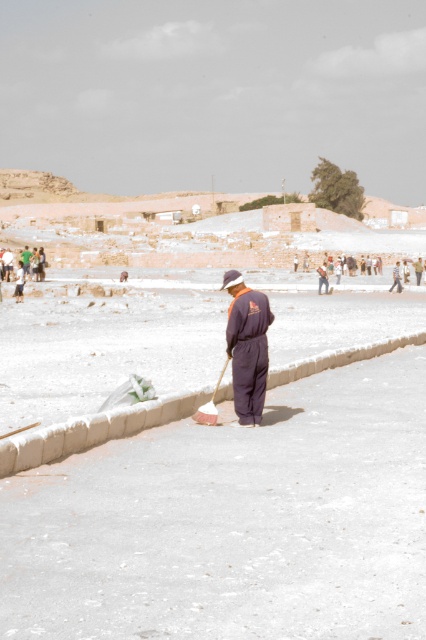
Is white concrete pavement at center above dark blue jumpsuit at center?

No, white concrete pavement at center is not above dark blue jumpsuit at center.

Is white concrete pavement at center to the right of dark blue jumpsuit at center from the viewer's perspective?

In fact, white concrete pavement at center is to the left of dark blue jumpsuit at center.

The height and width of the screenshot is (640, 426). Describe the element at coordinates (233, 522) in the screenshot. I see `white concrete pavement at center` at that location.

Identify the location of white concrete pavement at center. (233, 522).

Can you confirm if white concrete pavement at center is positioned to the left of white plastic shovel at center?

In fact, white concrete pavement at center is to the right of white plastic shovel at center.

Which of these two, white concrete pavement at center or white plastic shovel at center, stands taller?

Standing taller between the two is white plastic shovel at center.

What do you see at coordinates (233, 522) in the screenshot?
I see `white concrete pavement at center` at bounding box center [233, 522].

I want to click on white concrete pavement at center, so click(233, 522).

Is dark blue jumpsuit at center further to the viewer compared to white plastic shovel at center?

Yes, dark blue jumpsuit at center is further from the viewer.

Looking at this image, between dark blue jumpsuit at center and white plastic shovel at center, which one has less height?

A: dark blue jumpsuit at center

What do you see at coordinates (247, 346) in the screenshot? I see `dark blue jumpsuit at center` at bounding box center [247, 346].

Where is `dark blue jumpsuit at center`? Image resolution: width=426 pixels, height=640 pixels. dark blue jumpsuit at center is located at coordinates (247, 346).